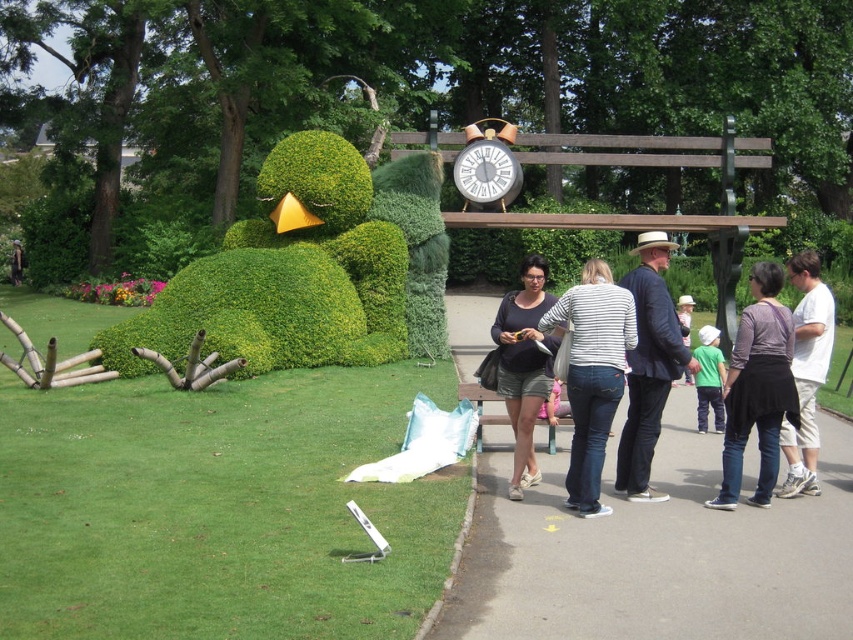
This screenshot has height=640, width=853. What do you see at coordinates (592, 374) in the screenshot?
I see `striped cotton shirt at center` at bounding box center [592, 374].

Does striped cotton shirt at center have a smaller size compared to dark gray sweater at center?

Indeed, striped cotton shirt at center has a smaller size compared to dark gray sweater at center.

Where is `striped cotton shirt at center`? The height and width of the screenshot is (640, 853). striped cotton shirt at center is located at coordinates (592, 374).

Where is `striped cotton shirt at center`? The height and width of the screenshot is (640, 853). striped cotton shirt at center is located at coordinates (592, 374).

Between dark gray sweater at center and matte black topiary at center, which one is positioned lower?

matte black topiary at center is below.

Who is taller, dark gray sweater at center or matte black topiary at center?

matte black topiary at center is taller.

I want to click on dark gray sweater at center, so click(x=757, y=388).

Where is `dark gray sweater at center`? This screenshot has height=640, width=853. dark gray sweater at center is located at coordinates (757, 388).

Is green bushy hedge at left taller than dark gray sweater at center?

Incorrect, green bushy hedge at left's height is not larger of dark gray sweater at center's.

Is green bushy hedge at left behind dark gray sweater at center?

Yes, it is.

Describe the element at coordinates (311, 269) in the screenshot. I see `green bushy hedge at left` at that location.

Image resolution: width=853 pixels, height=640 pixels. I want to click on green bushy hedge at left, so click(x=311, y=269).